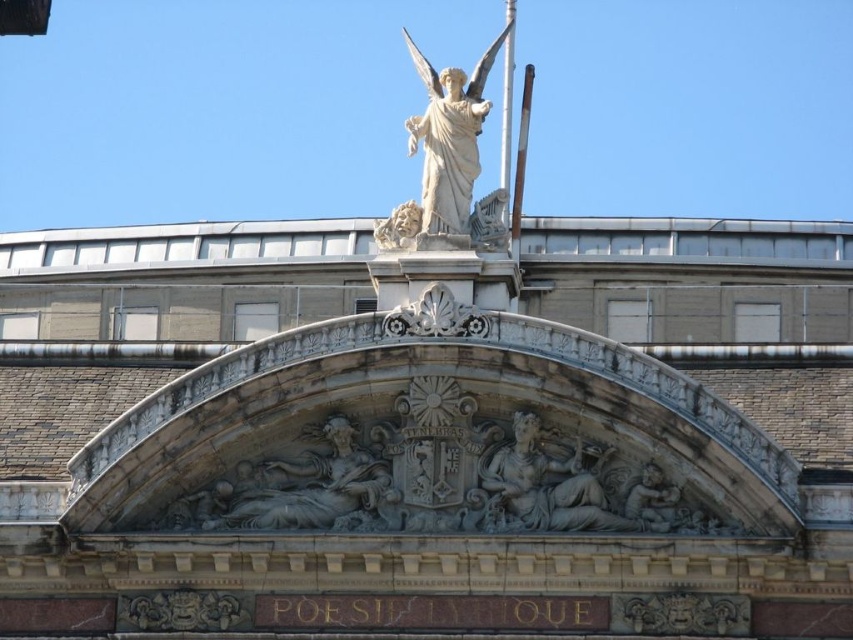
Question: Considering the relative positions of gray stone reclining figure at center and white stone cherub at upper center in the image provided, where is gray stone reclining figure at center located with respect to white stone cherub at upper center?

Choices:
 (A) below
 (B) above

Answer: (A)

Question: Does metallic flagpole at upper center appear under white stone cherub at upper center?

Choices:
 (A) yes
 (B) no

Answer: (B)

Question: Can you confirm if gray stone reclining figure at center is smaller than metallic flagpole at upper center?

Choices:
 (A) no
 (B) yes

Answer: (B)

Question: Which of the following is the farthest from the observer?

Choices:
 (A) (525, 92)
 (B) (511, 16)
 (C) (517, 420)
 (D) (479, 104)

Answer: (B)

Question: Which object is positioned closest to the gray stone reclining figure at center?

Choices:
 (A) white polished metal pole at upper center
 (B) metallic flagpole at upper center
 (C) white stone cherub at upper center
 (D) white marble statue at upper center

Answer: (C)

Question: Which of these objects is positioned closest to the gray stone reclining figure at center?

Choices:
 (A) metallic flagpole at upper center
 (B) white stone cherub at upper center
 (C) white polished metal pole at upper center
 (D) white marble statue at upper center

Answer: (B)